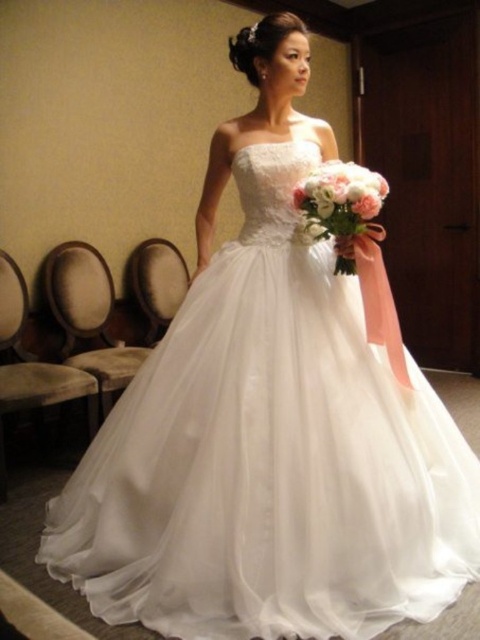
Between point (177, 452) and point (334, 272), which one is positioned behind?

Positioned behind is point (334, 272).

Which is behind, point (324, 484) or point (362, 168)?

The point (362, 168) is behind.

You are a GUI agent. You are given a task and a screenshot of the screen. Output one action in this format:
    pyautogui.click(x=<x>, y=<y>)
    Task: Click on the white tulle dress at center
    This screenshot has height=640, width=480.
    Given the screenshot: What is the action you would take?
    coord(269,456)